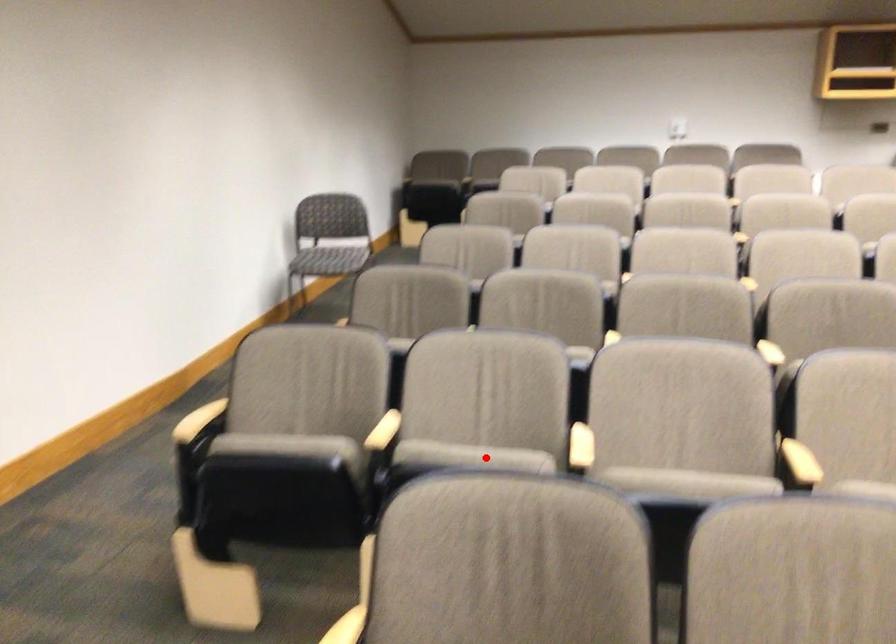
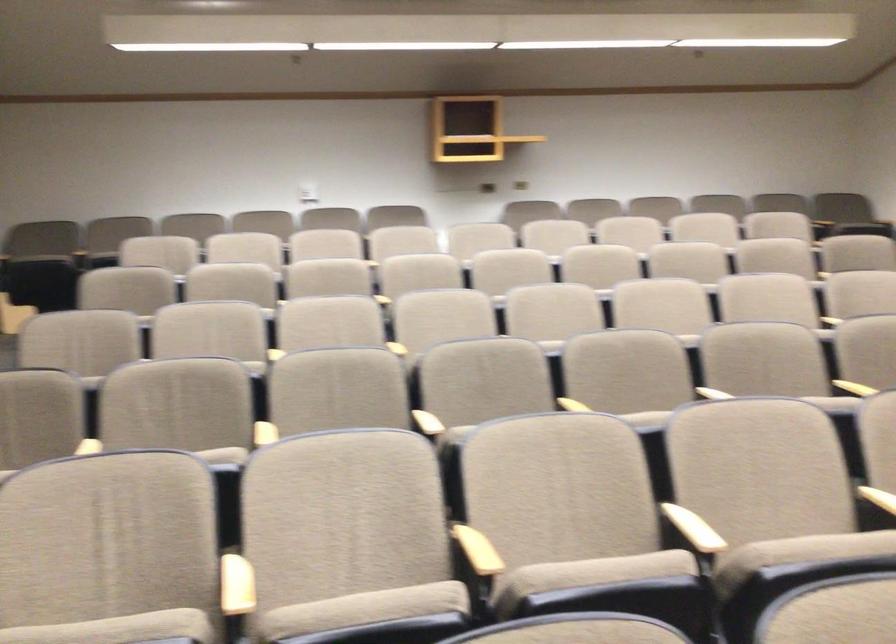
Find the pixel in the second image that matches the highlighted location in the first image.

(117, 629)